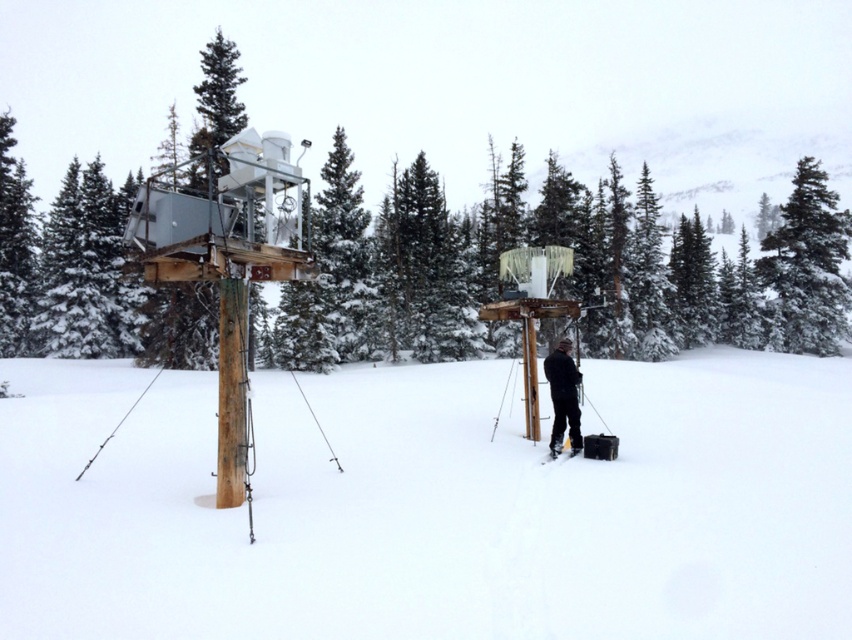
Question: Can you confirm if green snow-covered tree at upper left is positioned to the left of snow-covered evergreen at upper right?

Choices:
 (A) yes
 (B) no

Answer: (A)

Question: Considering the real-world distances, which object is closest to the white snow at center?

Choices:
 (A) snow-covered evergreen at upper right
 (B) black matte jacket at center

Answer: (B)

Question: Considering the real-world distances, which object is farthest from the white snow at center?

Choices:
 (A) snow-covered evergreen at upper right
 (B) black matte jacket at center

Answer: (A)

Question: Is green snow-covered tree at upper left smaller than snow-covered evergreen at upper right?

Choices:
 (A) no
 (B) yes

Answer: (B)

Question: Which of the following is the closest to the observer?

Choices:
 (A) (829, 228)
 (B) (459, 467)
 (C) (576, 401)

Answer: (B)

Question: Does green snow-covered tree at upper left come behind black matte jacket at center?

Choices:
 (A) yes
 (B) no

Answer: (A)